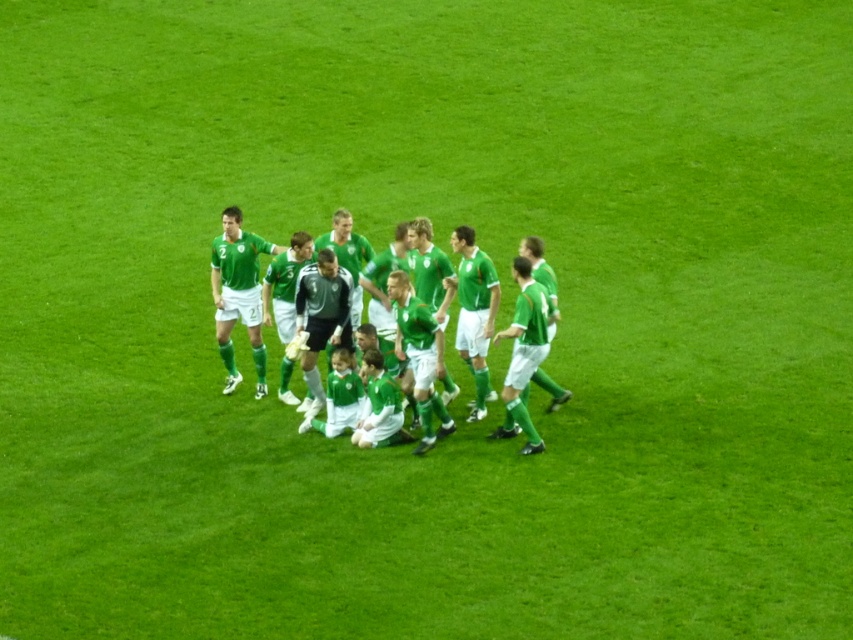
Is green jersey at center closer to camera compared to black jersey at center?

Yes, green jersey at center is in front of black jersey at center.

This screenshot has height=640, width=853. What do you see at coordinates (410, 236) in the screenshot? I see `green jersey at center` at bounding box center [410, 236].

Between point (354, 314) and point (329, 260), which one is positioned in front?

Point (329, 260) is more forward.

Find the location of `green jersey at center`. green jersey at center is located at coordinates (410, 236).

Consider the image. Which is more to the right, matte green jersey at center or black jersey at center?

black jersey at center

Is point (252, 330) positioned after point (316, 348)?

Yes, point (252, 330) is farther from viewer.

Identify the location of matte green jersey at center. The height and width of the screenshot is (640, 853). (238, 294).

Does green jersey at center have a greater height compared to matte green jersey at center?

In fact, green jersey at center may be shorter than matte green jersey at center.

Who is lower down, green jersey at center or matte green jersey at center?

Positioned lower is matte green jersey at center.

The width and height of the screenshot is (853, 640). In order to click on green jersey at center in this screenshot , I will do `click(410, 236)`.

At what (x,y) coordinates should I click in order to perform the action: click on green jersey at center. Please return your answer as a coordinate pair (x, y). Looking at the image, I should click on (410, 236).